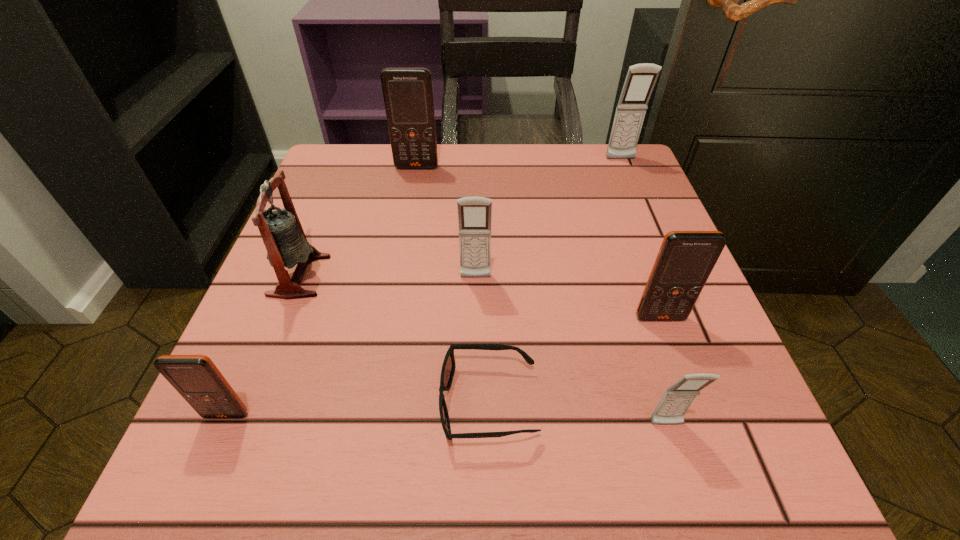
The height and width of the screenshot is (540, 960). Identify the location of the farthest object. (641, 78).

In order to click on the farthest cellular telephone in this screenshot , I will do `click(641, 78)`.

I want to click on the biggest orange cellular telephone, so click(408, 93).

What are the coordinates of `the second cellular telephone from left to right` in the screenshot? It's located at (408, 93).

Where is `bell`? The height and width of the screenshot is (540, 960). bell is located at coordinates (281, 231).

Image resolution: width=960 pixels, height=540 pixels. I want to click on the fourth nearest cellular telephone, so click(x=474, y=213).

Image resolution: width=960 pixels, height=540 pixels. What are the coordinates of `the leftmost gray cellular telephone` in the screenshot? It's located at (474, 213).

Image resolution: width=960 pixels, height=540 pixels. I want to click on the rightmost orange cellular telephone, so click(x=685, y=260).

At what (x,y) coordinates should I click in order to perform the action: click on the second smallest orange cellular telephone. Please return your answer as a coordinate pair (x, y). The image size is (960, 540). Looking at the image, I should click on (685, 260).

In order to click on the leftmost orange cellular telephone in this screenshot , I will do `click(196, 378)`.